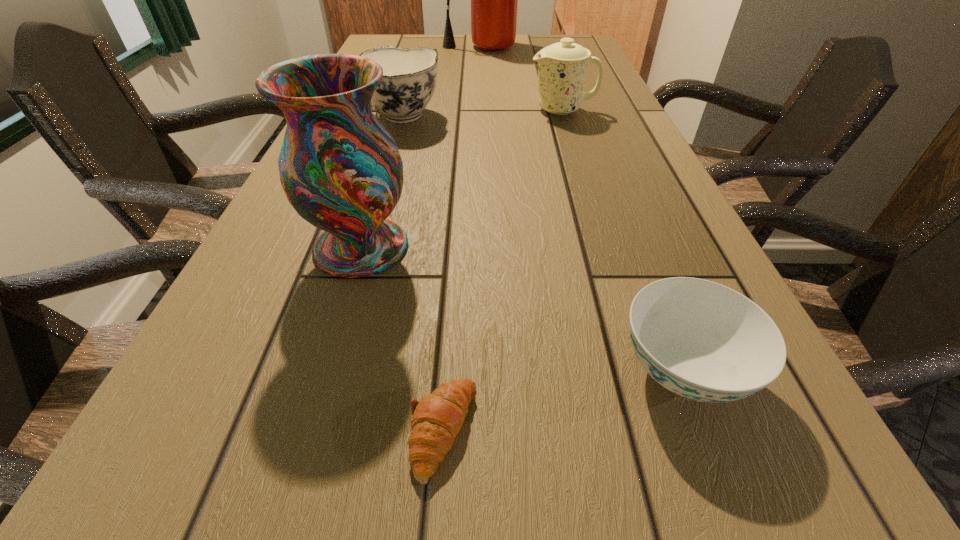
Where is `chinaware that is at the left edge`? chinaware that is at the left edge is located at coordinates (409, 75).

Locate an element on the screen. This screenshot has height=540, width=960. vacant space at the near edge of the desktop is located at coordinates (675, 539).

Where is `free spot at the right edge of the desktop`? free spot at the right edge of the desktop is located at coordinates (623, 105).

I want to click on free space at the far left corner of the desktop, so click(379, 45).

At what (x,y) coordinates should I click in order to perform the action: click on vacant space at the far right corner. Please return your answer as a coordinate pair (x, y). Looking at the image, I should click on (546, 42).

The image size is (960, 540). What are the coordinates of `free space between the shortest chinaware and the crescent roll` in the screenshot? It's located at (563, 401).

Locate an element on the screen. The image size is (960, 540). blank region between the fifth shortest object and the fifth tallest object is located at coordinates (521, 309).

This screenshot has height=540, width=960. I want to click on empty space that is in between the shortest object and the fourth farthest object, so coord(402,339).

You are a GUI agent. You are given a task and a screenshot of the screen. Output one action in this format:
    pyautogui.click(x=<x>, y=<y>)
    Task: Click on the free space between the tallest chinaware and the leftmost chinaware
    The image size is (960, 540).
    Given the screenshot: What is the action you would take?
    pyautogui.click(x=481, y=114)

Identify the location of empty space between the shortest object and the shortest chinaware. The image size is (960, 540). (563, 401).